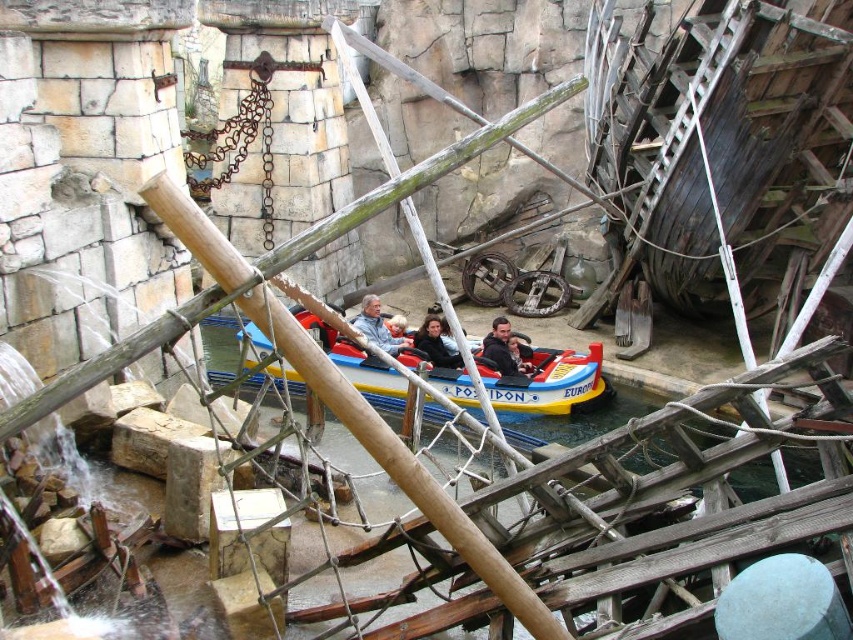
You are a ride safety inspector checking the distance between two passengers wearing smooth blue jacket at center and smooth black jacket at center on the boat labeled Poseidon and Europa. The safety guideline requires at least 5 meters between passengers for safety. Is the current distance compliant?

The smooth blue jacket at center is 6.07 meters from the smooth black jacket at center, which exceeds the required 5 meters, so the distance is compliant with safety guidelines.

You are standing at the edge of the shipwreck scene in the amusement park and see two points marked in the image. Which of these two points, point (393, 349) or point (445, 348), is closer to you?

Point (393, 349) is closer to the viewer than point (445, 348).

You are a ride operator checking the seating arrangement for the boat labeled Poseidon and Europa. You notice two passengers wearing smooth blue jacket at center and smooth black jacket at center. Which passenger is wearing a smaller jacket?

The smooth blue jacket at center has a smaller size compared to the smooth black jacket at center, so the passenger wearing the smooth blue jacket at center has the smaller jacket.